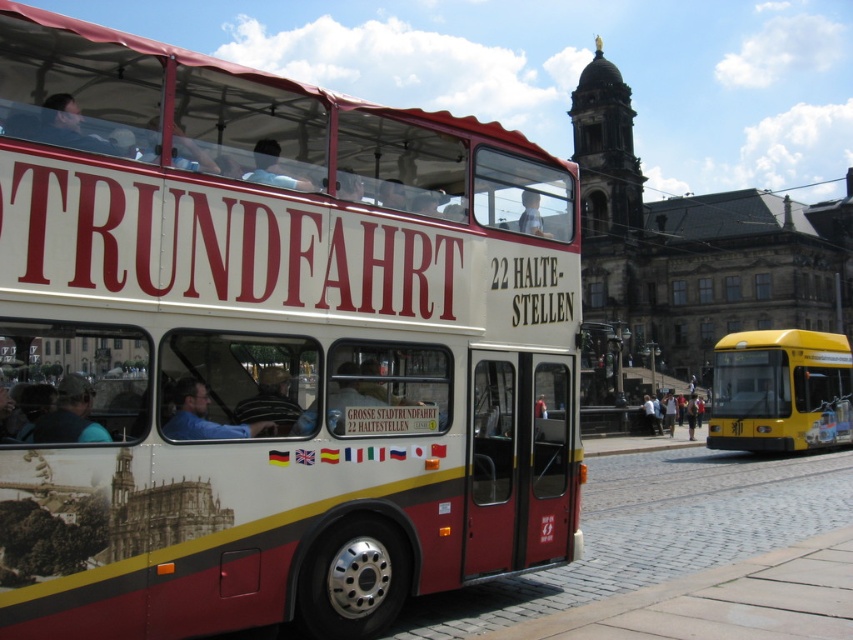
Who is positioned more to the left, matte white bus at center or blue shirt at driver left?

matte white bus at center is more to the left.

Locate an element on the screen. The width and height of the screenshot is (853, 640). matte white bus at center is located at coordinates (271, 344).

Between camouflage fabric cap at left and yellow plastic bus at center, which one has less height?

With less height is camouflage fabric cap at left.

Is point (74, 422) positioned in front of point (668, 403)?

Yes, point (74, 422) is in front of point (668, 403).

Between point (41, 419) and point (691, 426), which one is positioned behind?

The point (691, 426) is more distant.

The height and width of the screenshot is (640, 853). In order to click on camouflage fabric cap at left in this screenshot , I will do `click(70, 413)`.

What do you see at coordinates (271, 344) in the screenshot? I see `matte white bus at center` at bounding box center [271, 344].

Who is more distant from viewer, (10, 548) or (79, 378)?

Point (79, 378)

Is point (459, 296) closer to viewer compared to point (70, 378)?

No, (459, 296) is further to viewer.

This screenshot has width=853, height=640. Find the location of `matte white bus at center`. matte white bus at center is located at coordinates (271, 344).